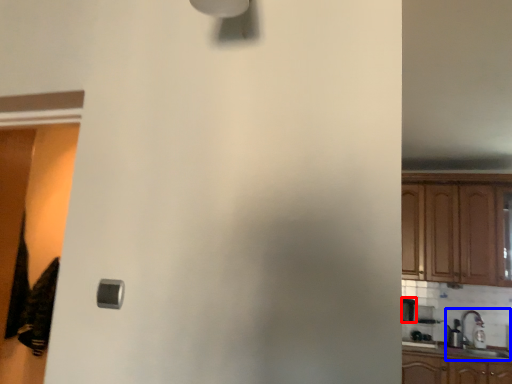
Question: Which point is further to the camera, appliance (highlighted by a red box) or sink (highlighted by a blue box)?

Choices:
 (A) appliance
 (B) sink

Answer: (A)